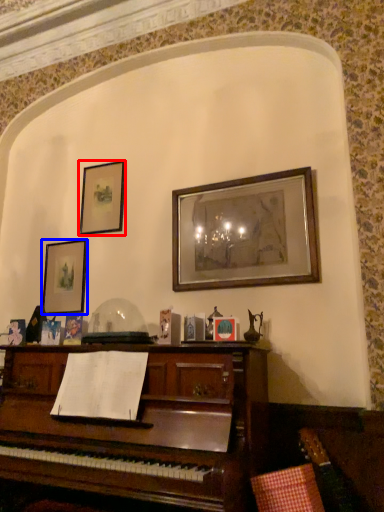
Question: Which object is further to the camera taking this photo, picture frame (highlighted by a red box) or picture frame (highlighted by a blue box)?

Choices:
 (A) picture frame
 (B) picture frame

Answer: (A)